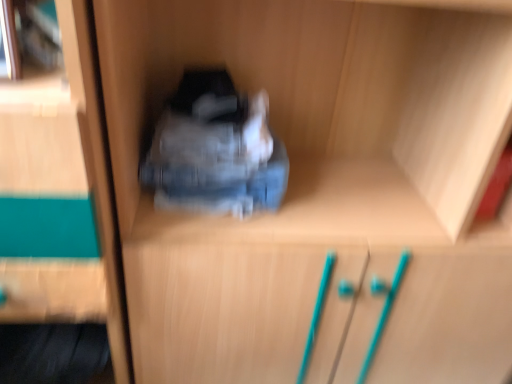
The width and height of the screenshot is (512, 384). In order to click on free space above denim at center (from a real-world perspective) in this screenshot , I will do `click(212, 118)`.